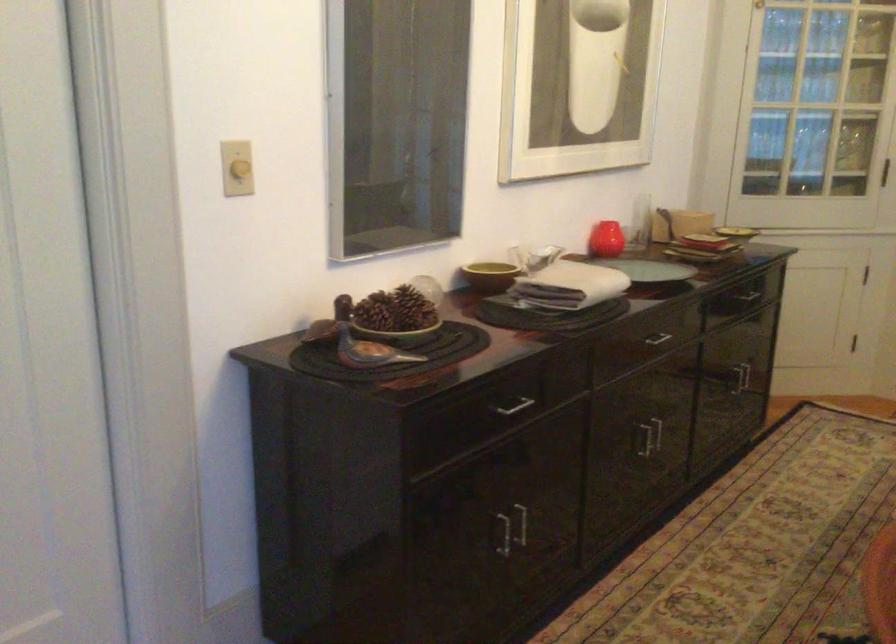
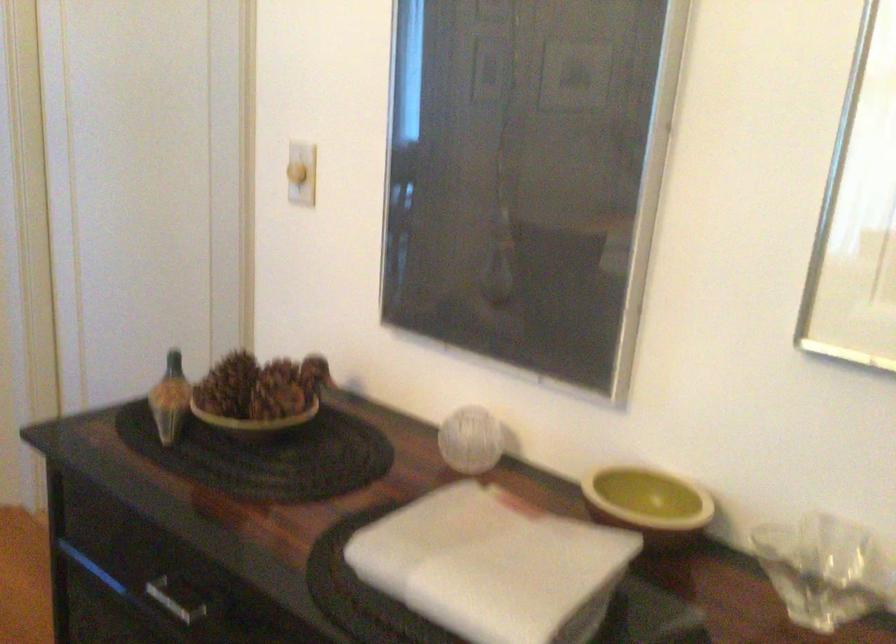
Locate, in the second image, the point that corresponds to the point at 373,328 in the first image.

(169, 399)